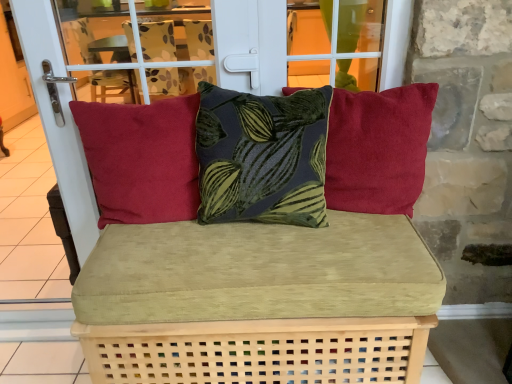
Locate an element on the screen. This screenshot has height=384, width=512. free location in front of velvet green leaf-patterned pillow at center, the second pillow in the right-to-left sequence is located at coordinates (269, 277).